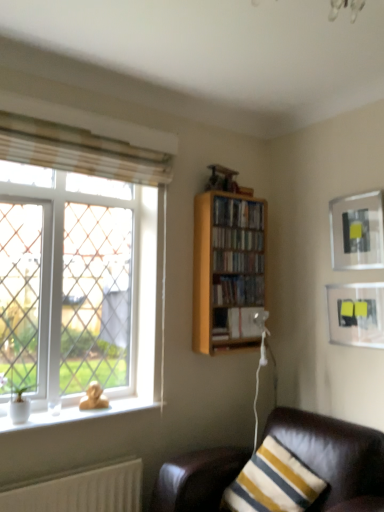
Measure the distance between point (163, 507) and camera.

Point (163, 507) is 6.98 feet from camera.

This screenshot has width=384, height=512. Find the location of `leather couch at lower right`. leather couch at lower right is located at coordinates (335, 457).

Find the location of `matte black picture frame at upper right, which is the 1th picture frame in bottom-to-top order`. matte black picture frame at upper right, which is the 1th picture frame in bottom-to-top order is located at coordinates (356, 314).

You are a GUI agent. You are given a task and a screenshot of the screen. Output one action in this format:
    pyautogui.click(x=<x>, y=<y>)
    Task: Click on the wooden bookshelf at center, which is the fourth book in bottom-to-top order
    Image resolution: width=384 pixels, height=512 pixels.
    Given the screenshot: What is the action you would take?
    pyautogui.click(x=237, y=239)

From the image's perspective, which is above, hardcover books at center, placed as the second book when sorted from bottom to top, or matte black picture frame at upper right, which is the 1th picture frame in bottom-to-top order?

hardcover books at center, placed as the second book when sorted from bottom to top.

Can you tell me how much hardcover books at center, acting as the 4th book starting from the top, and matte black picture frame at upper right, the second picture frame when ordered from top to bottom, differ in facing direction?

The angular difference between hardcover books at center, acting as the 4th book starting from the top, and matte black picture frame at upper right, the second picture frame when ordered from top to bottom, is 91 degrees.

Does point (225, 302) appear closer or farther from the camera than point (362, 326)?

Clearly, point (225, 302) is more distant from the camera than point (362, 326).

Measure the distance from hardcover books at center, acting as the 4th book starting from the top, to matte black picture frame at upper right, the second picture frame when ordered from top to bottom.

hardcover books at center, acting as the 4th book starting from the top, and matte black picture frame at upper right, the second picture frame when ordered from top to bottom, are 61.32 centimeters apart.

Which object is thinner, leather couch at lower right or wooden bookcase at upper right?

With smaller width is wooden bookcase at upper right.

Considering the relative positions of leather couch at lower right and wooden bookcase at upper right in the image provided, is leather couch at lower right to the right of wooden bookcase at upper right from the viewer's perspective?

Yes, leather couch at lower right is to the right of wooden bookcase at upper right.

Locate an element on the screen. bookcase that appears behind the leather couch at lower right is located at coordinates (x=228, y=271).

Is leather couch at lower right outside of wooden bookcase at upper right?

Yes.

How many degrees apart are the facing directions of white glass window at left and wooden bookshelf at center, the second book when ordered from top to bottom?

white glass window at left and wooden bookshelf at center, the second book when ordered from top to bottom, are facing 0.366 degrees away from each other.

Could you measure the distance between white glass window at left and wooden bookshelf at center, the second book when ordered from top to bottom?

32.85 inches.

Is white glass window at left positioned before wooden bookshelf at center, which is the fourth book in bottom-to-top order?

Yes.

From a real-world perspective, is white glass window at left positioned above or below wooden bookshelf at center, which is the fourth book in bottom-to-top order?

white glass window at left is below wooden bookshelf at center, which is the fourth book in bottom-to-top order.

Is matte black picture frame at upper right, the first picture frame viewed from the top, touching hardcover books at center, placed as the second book when sorted from bottom to top?

No, matte black picture frame at upper right, the first picture frame viewed from the top, is not in contact with hardcover books at center, placed as the second book when sorted from bottom to top.

Which of these two, matte black picture frame at upper right, acting as the second picture frame starting from the bottom, or hardcover books at center, placed as the second book when sorted from bottom to top, is wider?

hardcover books at center, placed as the second book when sorted from bottom to top.

Is matte black picture frame at upper right, the first picture frame viewed from the top, aimed at hardcover books at center, acting as the 4th book starting from the top?

No.

Which object is positioned more to the left, matte black picture frame at upper right, acting as the second picture frame starting from the bottom, or hardcover books at center, placed as the second book when sorted from bottom to top?

Positioned to the left is hardcover books at center, placed as the second book when sorted from bottom to top.

From a real-world perspective, is hardcover books at center, placed as the second book when sorted from bottom to top, positioned under white glass window at left based on gravity?

Yes, from a real-world perspective, hardcover books at center, placed as the second book when sorted from bottom to top, is beneath white glass window at left.

From the image's perspective, who appears lower, hardcover books at center, acting as the 4th book starting from the top, or white glass window at left?

hardcover books at center, acting as the 4th book starting from the top, from the image's perspective.

Is hardcover books at center, acting as the 4th book starting from the top, positioned in front of white glass window at left?

No, it is not.

Is hardcover books at center, placed as the second book when sorted from bottom to top, far away from white glass window at left?

No, hardcover books at center, placed as the second book when sorted from bottom to top, is not far away from white glass window at left.

From their relative heights in the image, would you say hardcover books at center, placed as the second book when sorted from bottom to top, is taller or shorter than wooden bookshelf at upper right, the third book in the top-to-bottom sequence?

In the image, hardcover books at center, placed as the second book when sorted from bottom to top, appears to be taller than wooden bookshelf at upper right, the third book in the top-to-bottom sequence.

Is hardcover books at center, acting as the 4th book starting from the top, inside or outside of wooden bookshelf at upper right, the 3th book from the bottom?

hardcover books at center, acting as the 4th book starting from the top, cannot be found inside wooden bookshelf at upper right, the 3th book from the bottom.

In the scene shown: Considering the relative sizes of hardcover books at center, placed as the second book when sorted from bottom to top, and wooden bookshelf at upper right, the 3th book from the bottom, in the image provided, is hardcover books at center, placed as the second book when sorted from bottom to top, smaller than wooden bookshelf at upper right, the 3th book from the bottom,?

Incorrect, hardcover books at center, placed as the second book when sorted from bottom to top, is not smaller in size than wooden bookshelf at upper right, the 3th book from the bottom.

Is point (218, 287) closer or farther from the camera than point (222, 258)?

Point (218, 287) is positioned closer to the camera compared to point (222, 258).

This screenshot has width=384, height=512. I want to click on bookcase that appears below the wooden bookshelf at center, which is the fourth book in bottom-to-top order (from the image's perspective), so click(228, 271).

Which object is further away from the camera, wooden bookcase at upper right or wooden bookshelf at center, which is the fourth book in bottom-to-top order?

Positioned behind is wooden bookshelf at center, which is the fourth book in bottom-to-top order.

Identify the location of picture frame below the hardcover books at center, placed as the second book when sorted from bottom to top (from the image's perspective). Image resolution: width=384 pixels, height=512 pixels. (356, 314).

At what (x,y) coordinates should I click in order to perform the action: click on studio couch on the right of the wooden bookcase at upper right. Please return your answer as a coordinate pair (x, y). Looking at the image, I should click on (335, 457).

Which object lies further to the anchor point wooden bookshelf at upper right, the 3th book from the bottom, leather couch at lower right or hardcover book at center, the fifth book viewed from the top?

leather couch at lower right is positioned further to the anchor wooden bookshelf at upper right, the 3th book from the bottom.

Based on the photo, based on their spatial positions, is wooden bookcase at upper right or wooden bookshelf at center, which is the fourth book in bottom-to-top order, further from hardcover book at center, the fifth book viewed from the top?

Among the two, wooden bookshelf at center, which is the fourth book in bottom-to-top order, is located further to hardcover book at center, the fifth book viewed from the top.

Based on the photo, from the image, which object appears to be nearer to wooden bookshelf at center, which is the fourth book in bottom-to-top order, leather couch at lower right or beige fabric curtain at upper left?

beige fabric curtain at upper left is positioned closer to the anchor wooden bookshelf at center, which is the fourth book in bottom-to-top order.

From the image, which object appears to be farther from wooden bookshelf at upper right, the 3th book from the bottom, wooden bookcase at upper right or wooden bookshelf at upper right, marked as the first book in a top-to-bottom arrangement?

wooden bookshelf at upper right, marked as the first book in a top-to-bottom arrangement, lies further to wooden bookshelf at upper right, the 3th book from the bottom, than the other object.

From the image, which object appears to be nearer to beige fabric curtain at upper left, matte black picture frame at upper right, the second picture frame when ordered from top to bottom, or hardcover books at center, acting as the 4th book starting from the top?

hardcover books at center, acting as the 4th book starting from the top, lies closer to beige fabric curtain at upper left than the other object.

Which object lies further to the anchor point matte black picture frame at upper right, acting as the second picture frame starting from the bottom, wooden bookshelf at upper right, placed as the 5th book when sorted from bottom to top, or hardcover books at center, acting as the 4th book starting from the top?

Based on the image, hardcover books at center, acting as the 4th book starting from the top, appears to be further to matte black picture frame at upper right, acting as the second picture frame starting from the bottom.

Considering their positions, is wooden bookshelf at upper right, placed as the 5th book when sorted from bottom to top, positioned further to white glass window at left than matte black picture frame at upper right, acting as the second picture frame starting from the bottom?

Among the two, matte black picture frame at upper right, acting as the second picture frame starting from the bottom, is located further to white glass window at left.

Considering their positions, is wooden bookshelf at center, which is the fourth book in bottom-to-top order, positioned closer to hardcover book at center, arranged as the 1th book when ordered from the bottom, than hardcover books at center, acting as the 4th book starting from the top?

Based on the image, hardcover books at center, acting as the 4th book starting from the top, appears to be nearer to hardcover book at center, arranged as the 1th book when ordered from the bottom.

Locate an element on the screen. Image resolution: width=384 pixels, height=512 pixels. book positioned between leather couch at lower right and wooden bookshelf at upper right, the third book in the top-to-bottom sequence, from near to far is located at coordinates (239, 290).

At what (x,y) coordinates should I click in order to perform the action: click on curtain between white glass window at left and matte black picture frame at upper right, which is the 1th picture frame in bottom-to-top order, in the horizontal direction. Please return your answer as a coordinate pair (x, y). The image size is (384, 512). Looking at the image, I should click on click(x=80, y=151).

Find the location of `bookcase between beige fabric curtain at upper left and wooden bookshelf at center, which is the fourth book in bottom-to-top order`. bookcase between beige fabric curtain at upper left and wooden bookshelf at center, which is the fourth book in bottom-to-top order is located at coordinates point(228,271).

The height and width of the screenshot is (512, 384). I want to click on bookcase between wooden bookshelf at upper right, placed as the 5th book when sorted from bottom to top, and hardcover books at center, acting as the 4th book starting from the top, in the vertical direction, so click(228, 271).